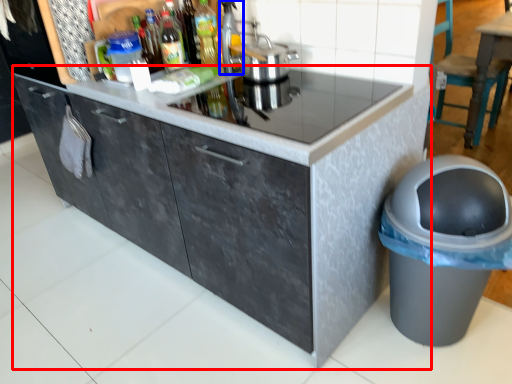
Question: Among these objects, which one is farthest to the camera, cabinetry (highlighted by a red box) or appliance (highlighted by a blue box)?

Choices:
 (A) cabinetry
 (B) appliance

Answer: (B)